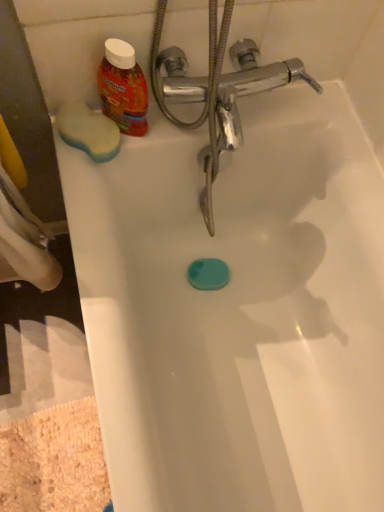
You are a GUI agent. You are given a task and a screenshot of the screen. Output one action in this format:
    pyautogui.click(x=<x>, y=<y>)
    Task: Click on the vacant space situated on the left part of matte plastic bottle at upper left
    This screenshot has width=384, height=512.
    Given the screenshot: What is the action you would take?
    pyautogui.click(x=80, y=122)